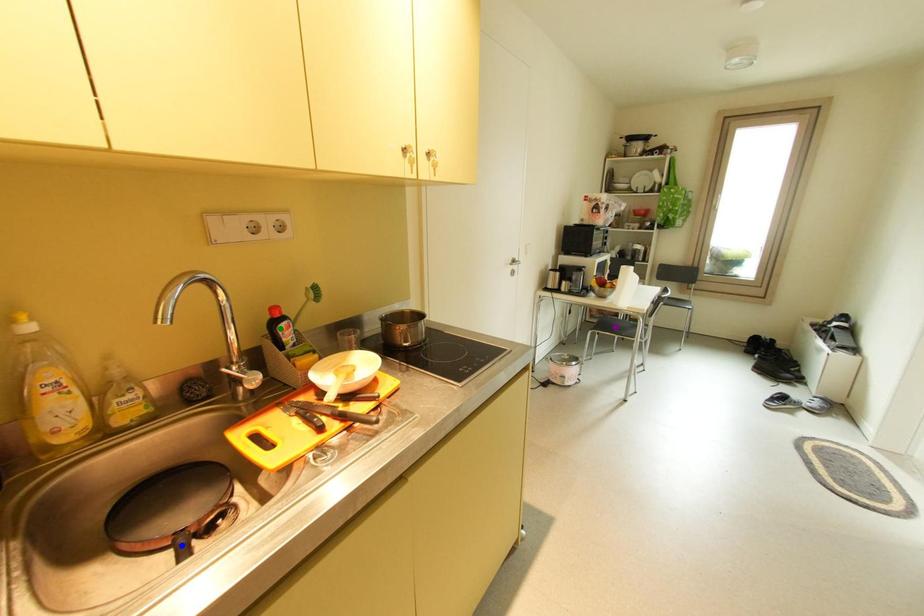
Order these from nearest to farthest:
blue point, green point, purple point

blue point, green point, purple point